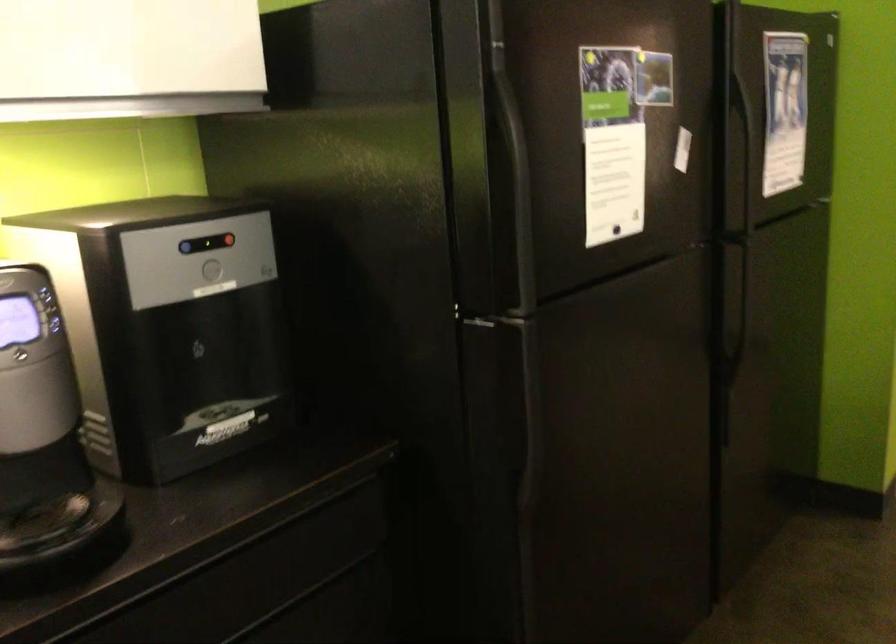
Find where to push the circular dispenser button. Please return your answer as a coordinate pair (x, y).

(211, 269)